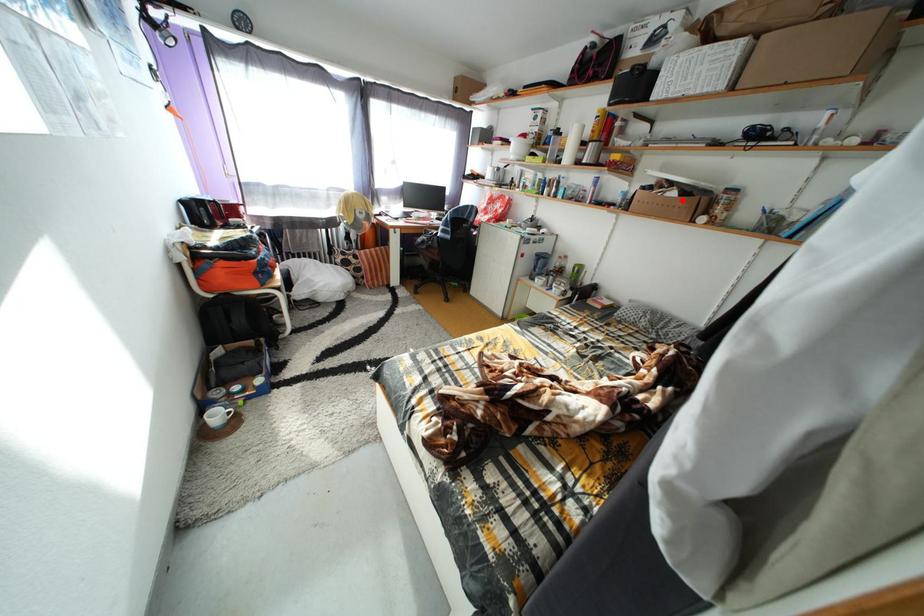
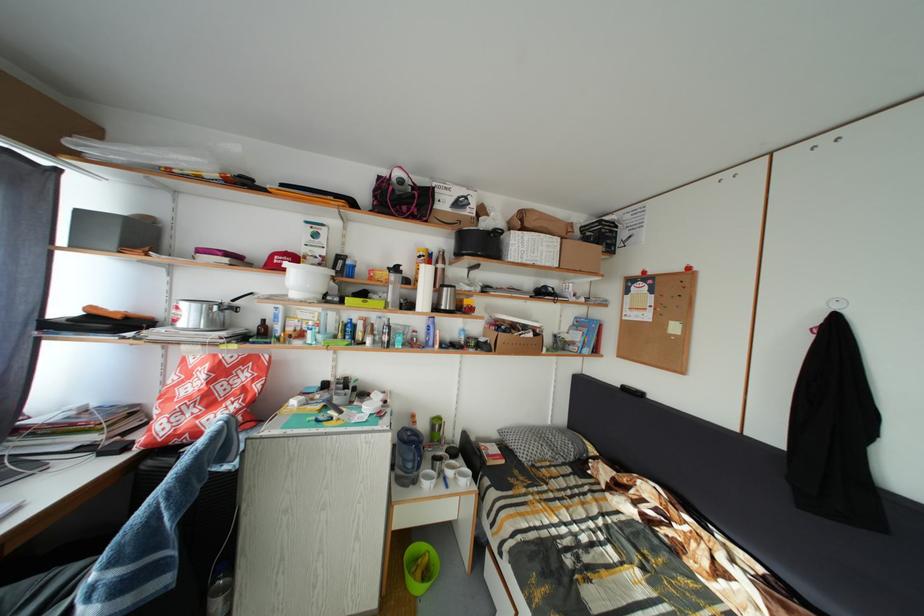
Find the pixel in the second image that matches the highlighted location in the first image.

(540, 341)